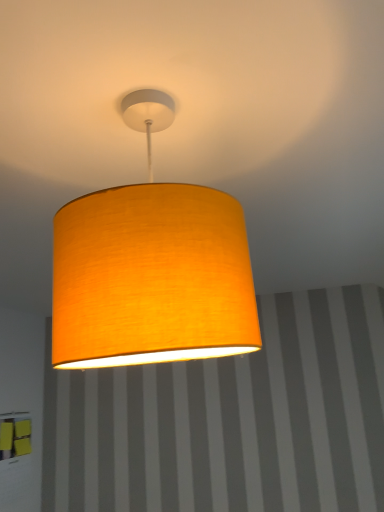
What do you see at coordinates (151, 268) in the screenshot? This screenshot has height=512, width=384. I see `orange fabric lampshade at center` at bounding box center [151, 268].

What are the coordinates of `orange fabric lampshade at center` in the screenshot? It's located at (151, 268).

Measure the distance between point (65, 350) and camera.

Point (65, 350) and camera are 19.76 inches apart from each other.

Based on the photo, what is the approximate height of orange fabric lampshade at center?

16.64 inches.

The width and height of the screenshot is (384, 512). I want to click on orange fabric lampshade at center, so click(x=151, y=268).